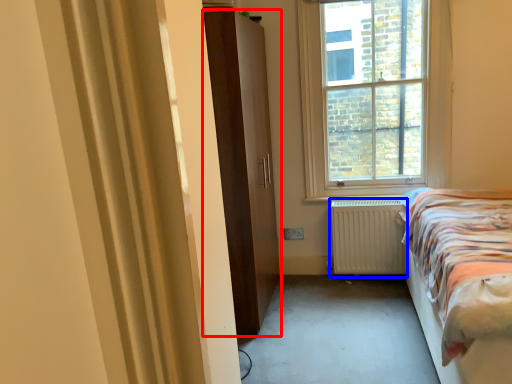
Question: Which of the following is the farthest to the observer, door (highlighted by a red box) or radiator (highlighted by a blue box)?

Choices:
 (A) door
 (B) radiator

Answer: (B)